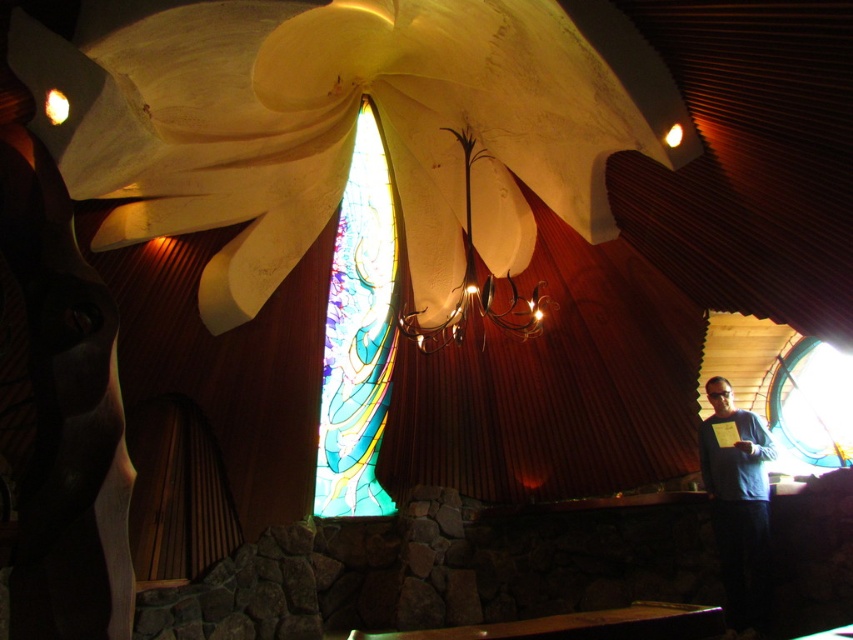
Question: Can you confirm if white textured ceiling at center is positioned below blue sweater at center?

Choices:
 (A) no
 (B) yes

Answer: (A)

Question: Is blue sweater at center further to camera compared to metallic gold chandelier at upper center?

Choices:
 (A) yes
 (B) no

Answer: (B)

Question: Which point appears closest to the camera in this image?

Choices:
 (A) (515, 326)
 (B) (370, 120)
 (C) (772, 449)
 (D) (454, 179)

Answer: (C)

Question: Estimate the real-world distances between objects in this image. Which object is farther from the stained glass window at center?

Choices:
 (A) blue sweater at center
 (B) white textured ceiling at center

Answer: (A)

Question: Is blue sweater at center below metallic gold chandelier at upper center?

Choices:
 (A) yes
 (B) no

Answer: (A)

Question: Based on their relative distances, which object is farther from the stained glass window at center?

Choices:
 (A) metallic gold chandelier at upper center
 (B) blue sweater at center

Answer: (B)